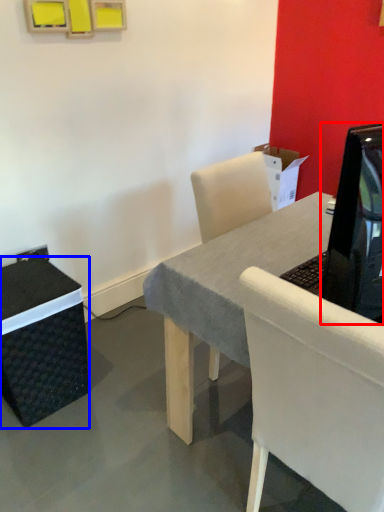
Question: Among these objects, which one is nearest to the camera, television (highlighted by a red box) or box (highlighted by a blue box)?

Choices:
 (A) television
 (B) box

Answer: (A)